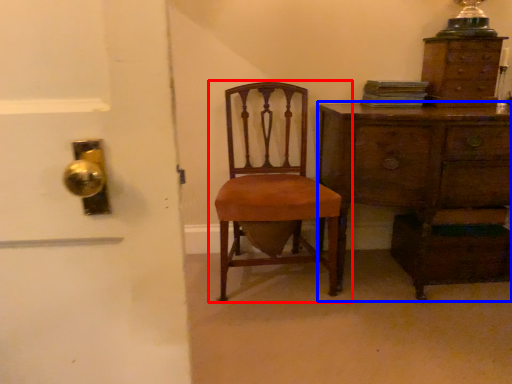
Question: Which object appears closest to the camera in this image, chair (highlighted by a red box) or chest of drawers (highlighted by a blue box)?

Choices:
 (A) chair
 (B) chest of drawers

Answer: (A)